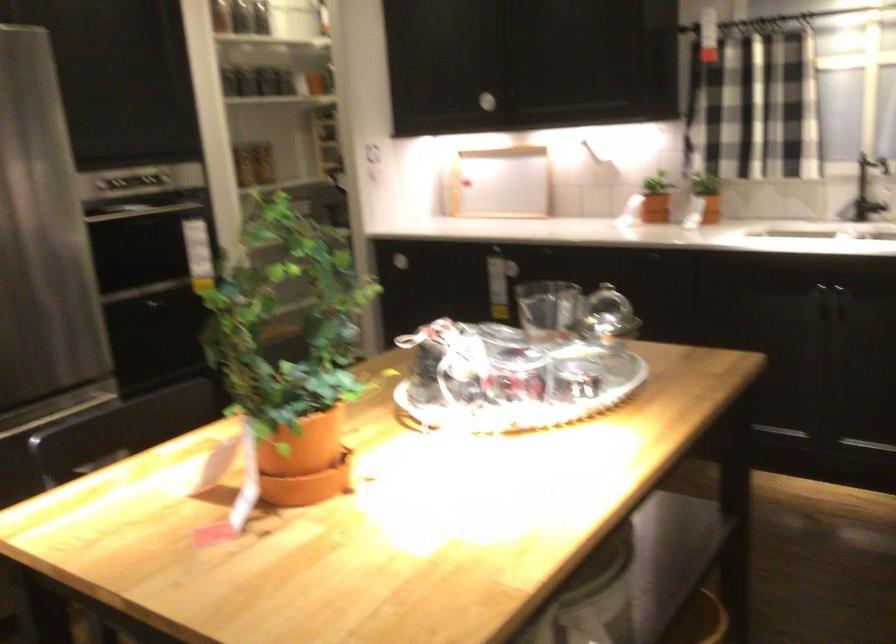
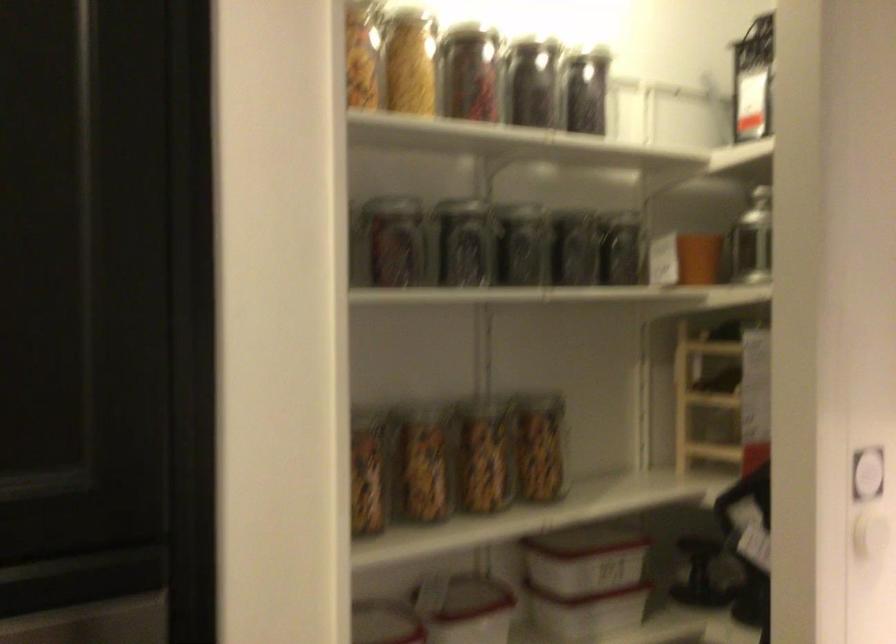
In the second image, find the point that corresponds to [286,69] in the first image.

(622, 249)